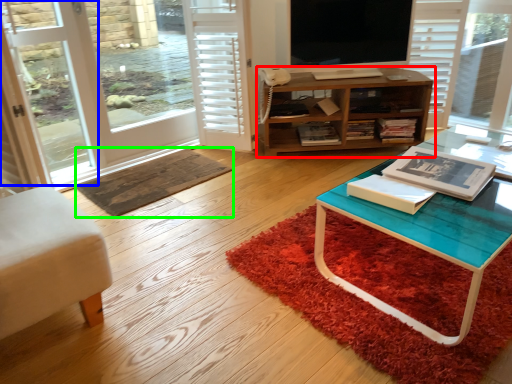
Question: Considering the real-world distances, which object is closest to cabinetry (highlighted by a red box)? screen door (highlighted by a blue box) or doormat (highlighted by a green box).

Choices:
 (A) screen door
 (B) doormat

Answer: (B)